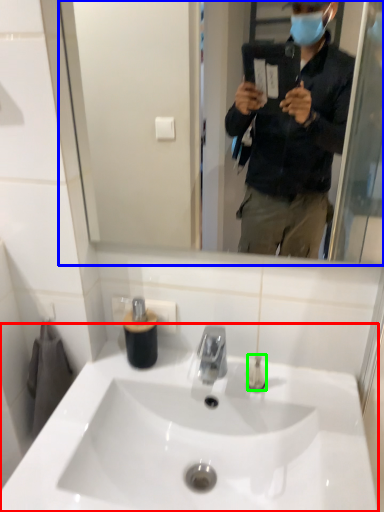
Question: Which object is the farthest from sink (highlighted by a red box)? Choose among these: mirror (highlighted by a blue box) or toiletry (highlighted by a green box).

Choices:
 (A) mirror
 (B) toiletry

Answer: (A)